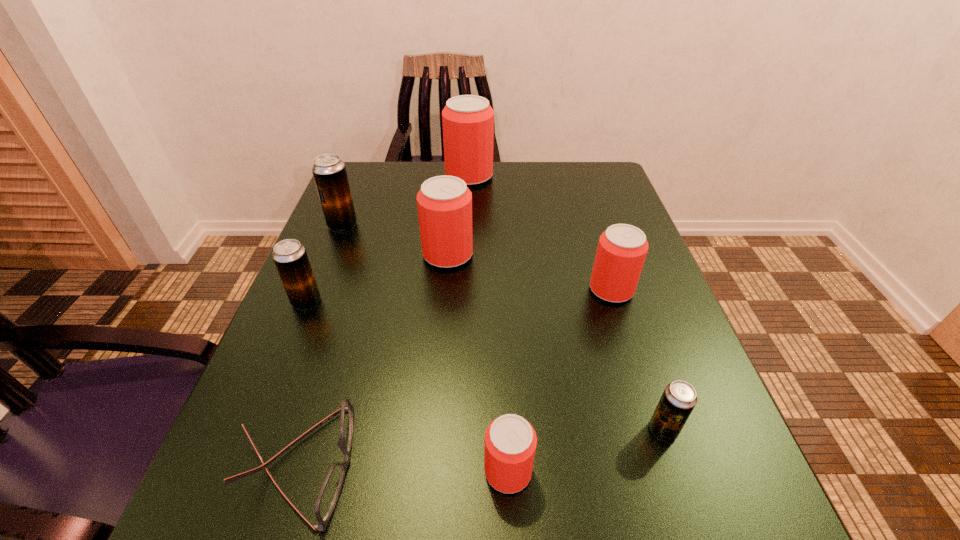
Image resolution: width=960 pixels, height=540 pixels. I want to click on the tallest beer can, so click(468, 120).

In order to click on the tallest object in this screenshot , I will do click(468, 120).

Where is `the biggest black beer can`? This screenshot has height=540, width=960. the biggest black beer can is located at coordinates (329, 171).

Locate an element on the screen. This screenshot has width=960, height=540. the seventh nearest object is located at coordinates (329, 171).

I want to click on the third farthest beer can, so click(444, 203).

Locate an element on the screen. This screenshot has height=540, width=960. the second farthest red beer can is located at coordinates (444, 203).

The width and height of the screenshot is (960, 540). Identify the location of the second nearest red beer can. (622, 248).

Find the location of `the third biggest red beer can`. the third biggest red beer can is located at coordinates (622, 248).

Find the location of a particular element. The height and width of the screenshot is (540, 960). the second biggest black beer can is located at coordinates (290, 257).

Image resolution: width=960 pixels, height=540 pixels. Identify the location of the sixth farthest beer can. (679, 398).